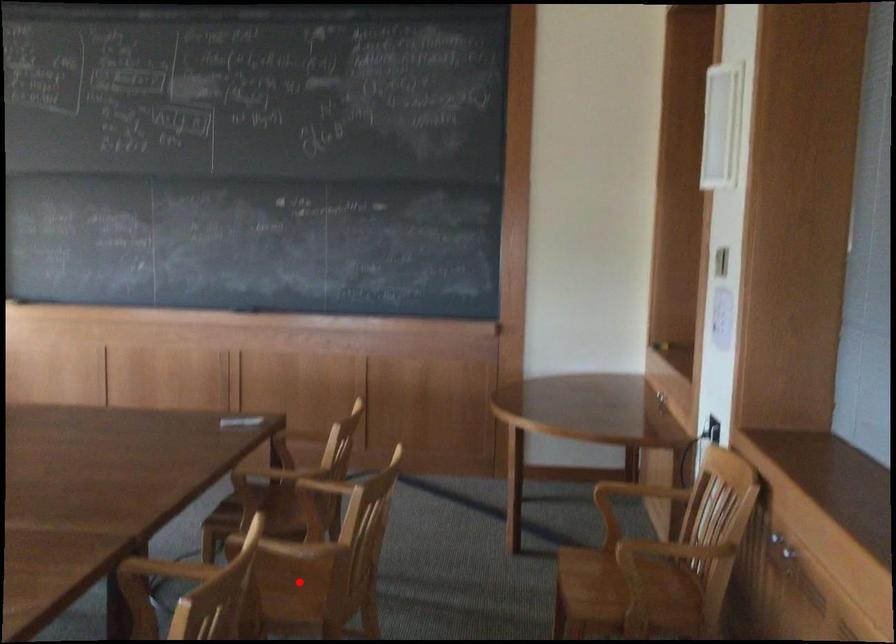
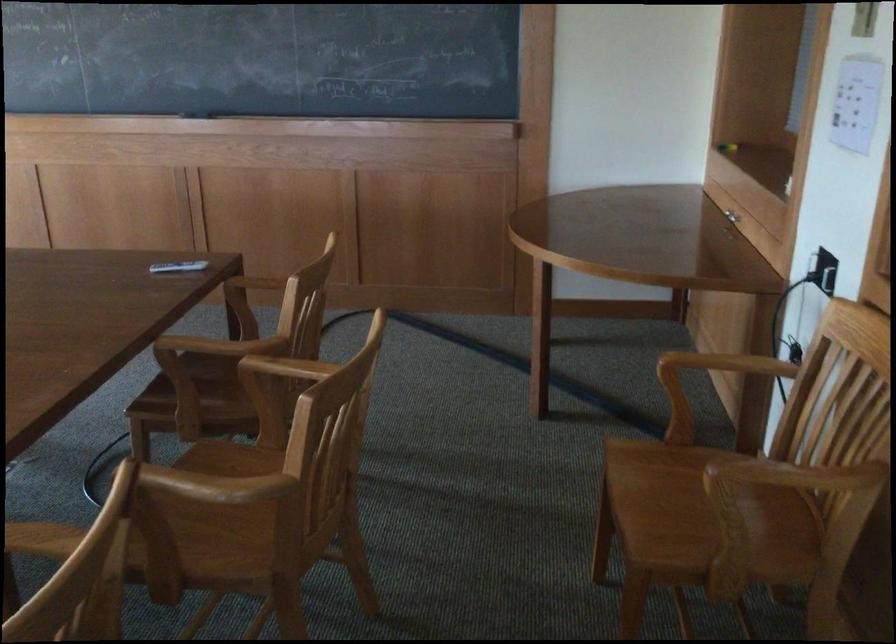
Question: I am providing you with two images of the same scene from different viewpoints. A red point is marked on the first image. Is the red point's position out of view in image 2?

Choices:
 (A) Yes
 (B) No

Answer: (A)